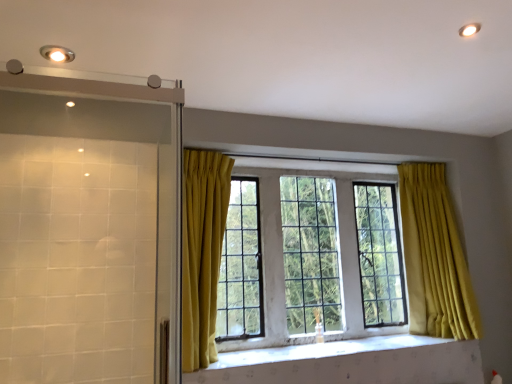
What are the coordinates of `unoccupied area in front of white glossy light fixture at upper right` in the screenshot? It's located at (482, 13).